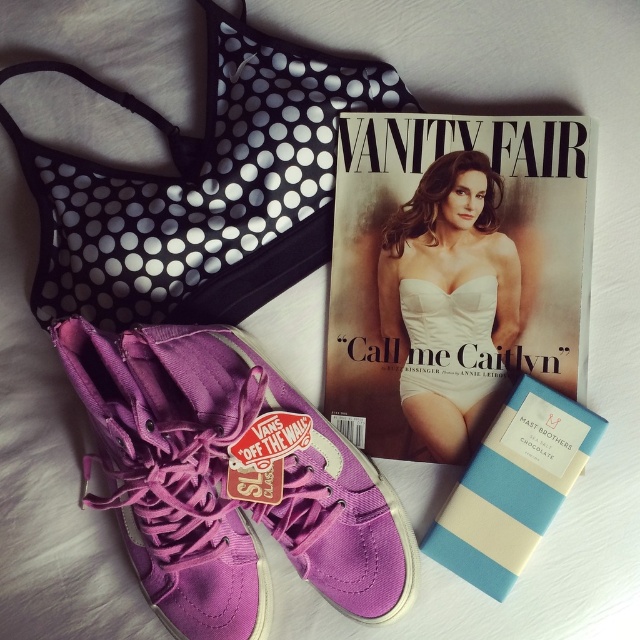
You are organizing a drawer and need to stack the purple canvas sneaker at center and the matte black bra at upper center vertically. Which item should you place at the bottom of the stack to ensure stability?

The purple canvas sneaker at center is taller than the matte black bra at upper center, so you should place the purple canvas sneaker at center at the bottom of the stack for better stability.

You are packing a gift box and need to place the purple canvas shoe at center and the blue striped chocolate bar at center inside. The box has a length of 10 inches. Will both items fit side by side in the box without overlapping?

The purple canvas shoe at center is 9.96 inches from the blue striped chocolate bar at center, so they can fit side by side in the 10 inch box since the distance between them is less than the box length.